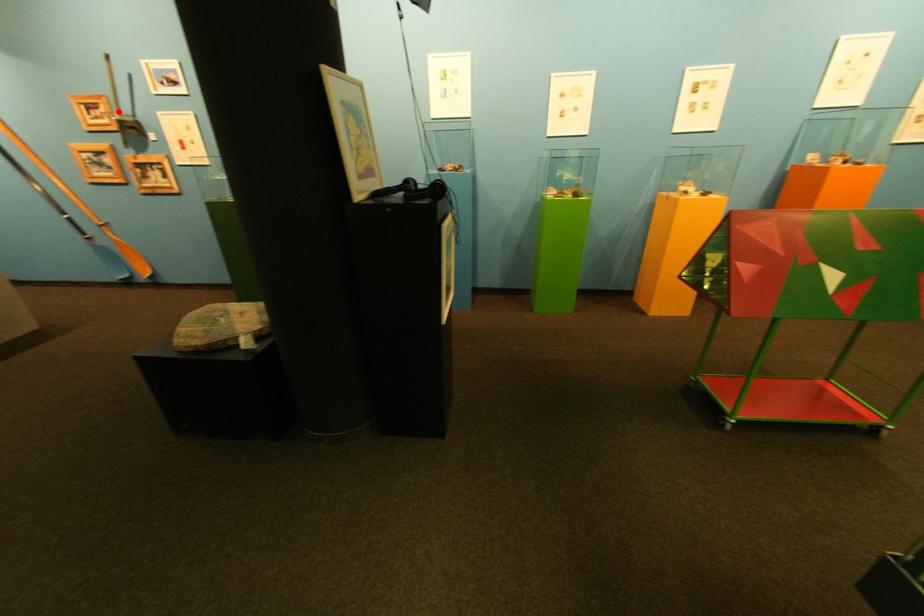
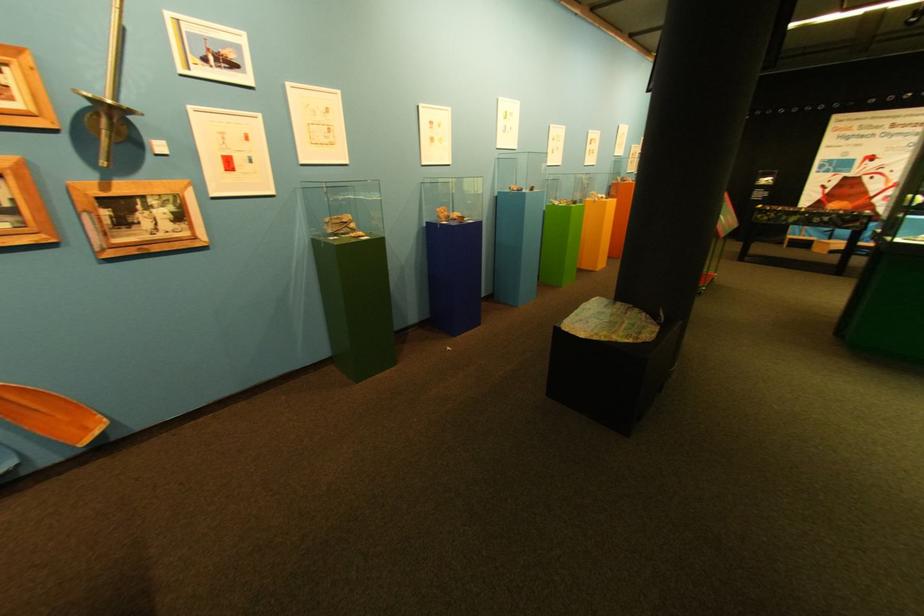
Find the pixel in the second image that matches the highlighted location in the first image.

(22, 81)